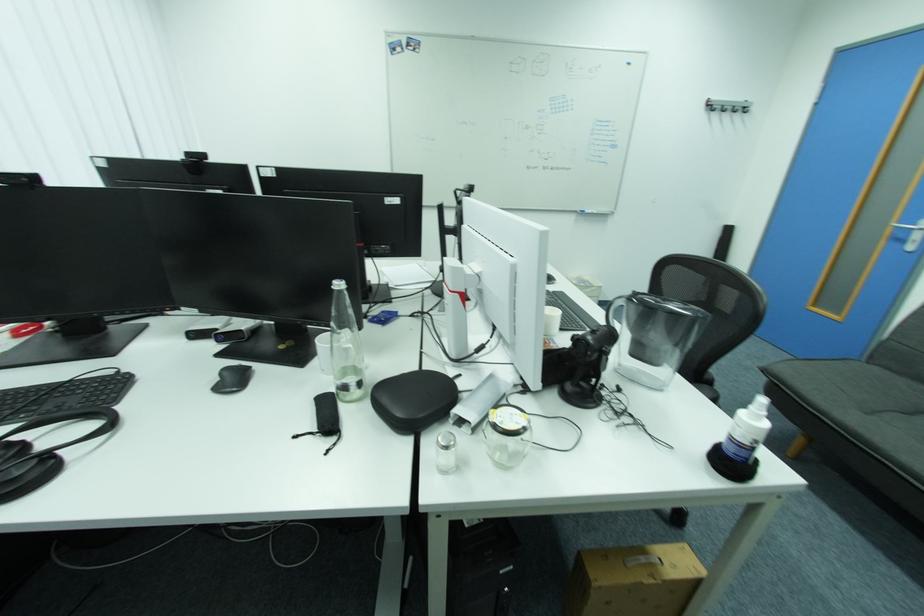
I want to click on water pitcher handle, so click(615, 313).